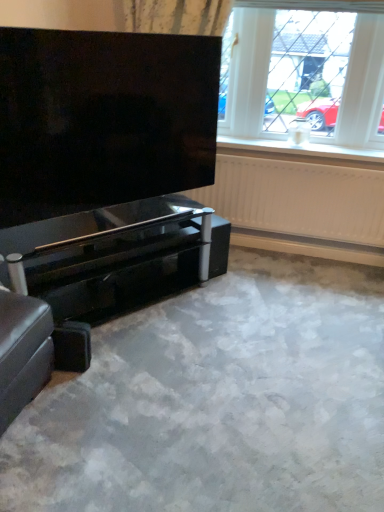
The height and width of the screenshot is (512, 384). What do you see at coordinates (23, 352) in the screenshot? I see `leather ottoman at lower left` at bounding box center [23, 352].

This screenshot has width=384, height=512. What do you see at coordinates (176, 16) in the screenshot?
I see `satin fabric curtain at upper center` at bounding box center [176, 16].

Locate an element on the screen. Image resolution: width=384 pixels, height=512 pixels. white textured radiator at upper right is located at coordinates (298, 198).

You are a GUI agent. You are given a task and a screenshot of the screen. Output one action in this format:
    pyautogui.click(x=<x>, y=<y>)
    Task: Click on the white plastic window sill at upper center
    Image resolution: width=384 pixels, height=512 pixels.
    Given the screenshot: What is the action you would take?
    pyautogui.click(x=298, y=151)

Which object is further away from the camera taking this photo, satin fabric curtain at upper center or black glossy screen at upper left?

satin fabric curtain at upper center is further away from the camera.

Is satin fabric curtain at upper center far from black glossy screen at upper left?

No, satin fabric curtain at upper center is not far away from black glossy screen at upper left.

Considering the relative sizes of satin fabric curtain at upper center and black glossy screen at upper left in the image provided, is satin fabric curtain at upper center smaller than black glossy screen at upper left?

Yes.

Is point (197, 13) less distant than point (6, 92)?

No, (197, 13) is further to viewer.

Who is taller, glossy black piano at lower left or black glossy screen at upper left?

black glossy screen at upper left.

From a real-world perspective, between glossy black piano at lower left and black glossy screen at upper left, who is vertically higher?

In real-world perspective, black glossy screen at upper left is above.

Based on their sizes in the image, would you say glossy black piano at lower left is bigger or smaller than black glossy screen at upper left?

Clearly, glossy black piano at lower left is larger in size than black glossy screen at upper left.

Is glossy black piano at lower left further to camera compared to black glossy screen at upper left?

Yes.

Which is behind, point (242, 155) or point (246, 219)?

The point (246, 219) is more distant.

Is white plastic window sill at upper center looking in the opposite direction of white textured radiator at upper right?

No, white plastic window sill at upper center's orientation is not away from white textured radiator at upper right.

From a real-world perspective, who is located lower, white plastic window sill at upper center or white textured radiator at upper right?

white textured radiator at upper right.

Is white plastic window at upper center spatially inside white textured radiator at upper right, or outside of it?

white plastic window at upper center exists outside the volume of white textured radiator at upper right.

Can you confirm if white plastic window at upper center is wider than white textured radiator at upper right?

Correct, the width of white plastic window at upper center exceeds that of white textured radiator at upper right.

From the image's perspective, is white plastic window at upper center above or below white textured radiator at upper right?

Based on their image positions, white plastic window at upper center is located above white textured radiator at upper right.

From the image's perspective, is white textured radiator at upper right above leather ottoman at lower left?

Indeed, from the image's perspective, white textured radiator at upper right is shown above leather ottoman at lower left.

Would you say white textured radiator at upper right contains leather ottoman at lower left?

No, leather ottoman at lower left is not surrounded by white textured radiator at upper right.

Between point (242, 187) and point (12, 295), which one is positioned behind?

Point (242, 187)

Considering their positions, is white plastic window at upper center located in front of or behind glossy black piano at lower left?

Clearly, white plastic window at upper center is behind glossy black piano at lower left.

Considering the sizes of objects white plastic window at upper center and glossy black piano at lower left in the image provided, who is thinner, white plastic window at upper center or glossy black piano at lower left?

white plastic window at upper center is thinner.

Considering the sizes of objects white plastic window at upper center and glossy black piano at lower left in the image provided, who is bigger, white plastic window at upper center or glossy black piano at lower left?

Bigger between the two is glossy black piano at lower left.

Is white plastic window at upper center shorter than glossy black piano at lower left?

No.

Who is taller, black glossy screen at upper left or glossy black piano at lower left?

Standing taller between the two is black glossy screen at upper left.

From a real-world perspective, is black glossy screen at upper left over glossy black piano at lower left?

Correct, in the physical world, black glossy screen at upper left is higher than glossy black piano at lower left.

Based on the photo, from the image's perspective, is black glossy screen at upper left positioned above or below glossy black piano at lower left?

Based on their image positions, black glossy screen at upper left is located above glossy black piano at lower left.

Can you confirm if black glossy screen at upper left is smaller than glossy black piano at lower left?

Indeed, black glossy screen at upper left has a smaller size compared to glossy black piano at lower left.

Where is `screen lying in front of the satin fabric curtain at upper center`? The image size is (384, 512). screen lying in front of the satin fabric curtain at upper center is located at coordinates (103, 119).

In order to click on screen on the right of glossy black piano at lower left in this screenshot , I will do `click(103, 119)`.

Considering their positions, is white plastic window sill at upper center positioned further to glossy black piano at lower left than white textured radiator at upper right?

Based on the image, white plastic window sill at upper center appears to be further to glossy black piano at lower left.

From the image, which object appears to be farther from black glossy screen at upper left, satin fabric curtain at upper center or glossy black piano at lower left?

satin fabric curtain at upper center.

In the scene shown: Which object lies nearer to the anchor point black glossy screen at upper left, leather ottoman at lower left or white textured radiator at upper right?

leather ottoman at lower left is positioned closer to the anchor black glossy screen at upper left.

Which object lies further to the anchor point black glossy screen at upper left, white plastic window at upper center or white textured radiator at upper right?

white plastic window at upper center lies further to black glossy screen at upper left than the other object.

When comparing their distances from glossy black piano at lower left, does leather ottoman at lower left or white plastic window at upper center seem closer?

leather ottoman at lower left is positioned closer to the anchor glossy black piano at lower left.

Considering their positions, is white plastic window at upper center positioned closer to satin fabric curtain at upper center than glossy black piano at lower left?

The object closer to satin fabric curtain at upper center is white plastic window at upper center.

Estimate the real-world distances between objects in this image. Which object is further from white plastic window at upper center, white plastic window sill at upper center or black glossy screen at upper left?

black glossy screen at upper left.

Which object lies nearer to the anchor point glossy black piano at lower left, satin fabric curtain at upper center or leather ottoman at lower left?

leather ottoman at lower left is positioned closer to the anchor glossy black piano at lower left.

I want to click on curtain between white plastic window at upper center and white textured radiator at upper right vertically, so click(x=176, y=16).

Where is `curtain between black glossy screen at upper left and white textured radiator at upper right along the z-axis`? The height and width of the screenshot is (512, 384). curtain between black glossy screen at upper left and white textured radiator at upper right along the z-axis is located at coordinates (176, 16).

What are the coordinates of `curtain between white plastic window at upper center and leather ottoman at lower left in the vertical direction` in the screenshot? It's located at (176, 16).

The image size is (384, 512). In order to click on window sill between white plastic window at upper center and leather ottoman at lower left from top to bottom in this screenshot , I will do `click(298, 151)`.